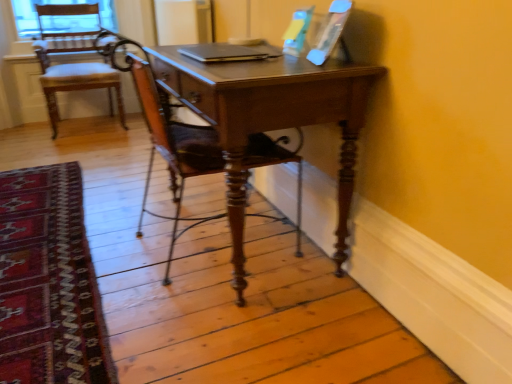
Question: Is silver metallic laptop at center spatially inside wooden chair at left, positioned as the 2th chair in right-to-left order, or outside of it?

Choices:
 (A) outside
 (B) inside

Answer: (A)

Question: Does point click(206, 51) appear closer or farther from the camera than point click(82, 36)?

Choices:
 (A) closer
 (B) farther

Answer: (A)

Question: Which object is positioned closest to the wooden chair at left, marked as the second chair in a front-to-back arrangement?

Choices:
 (A) carpet with intricate patterns at lower left
 (B) silver metallic laptop at center
 (C) wooden polished chair at center, which is the second chair from back to front

Answer: (C)

Question: Which object is the farthest from the wooden chair at left, the first chair from the back?

Choices:
 (A) wooden polished chair at center, the 2th chair positioned from the left
 (B) silver metallic laptop at center
 (C) carpet with intricate patterns at lower left

Answer: (B)